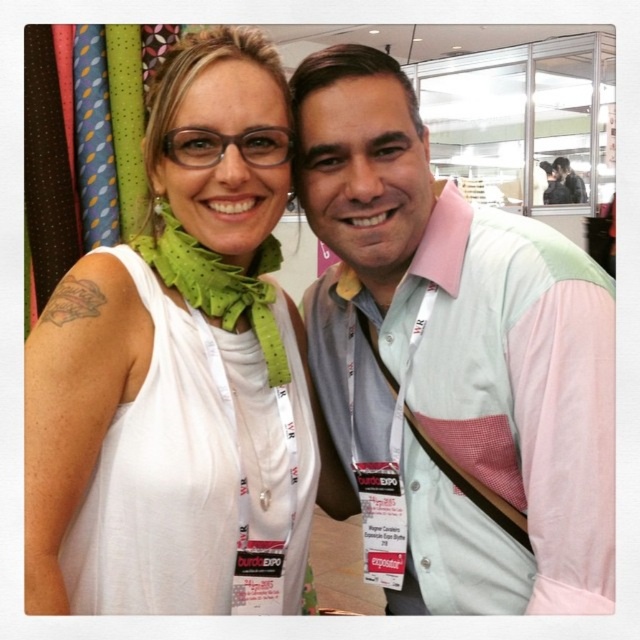
Question: Which point is farther to the camera?

Choices:
 (A) (269, 237)
 (B) (36, 484)

Answer: (A)

Question: Where is white fabric at center located in relation to green polka dot fabric scarf at upper left in the image?

Choices:
 (A) below
 (B) above

Answer: (A)

Question: In this image, where is pink fabric vest at center located relative to green polka dot fabric scarf at upper left?

Choices:
 (A) left
 (B) right

Answer: (B)

Question: Considering the relative positions of white fabric at center and green polka dot fabric scarf at upper left in the image provided, where is white fabric at center located with respect to green polka dot fabric scarf at upper left?

Choices:
 (A) left
 (B) right

Answer: (A)

Question: Which point is closer to the camera taking this photo?

Choices:
 (A) (314, 97)
 (B) (257, 524)
 (C) (156, 209)

Answer: (B)

Question: Which point is closer to the camera?

Choices:
 (A) white fabric at center
 (B) pink fabric vest at center
 (C) green polka dot fabric scarf at upper left

Answer: (A)